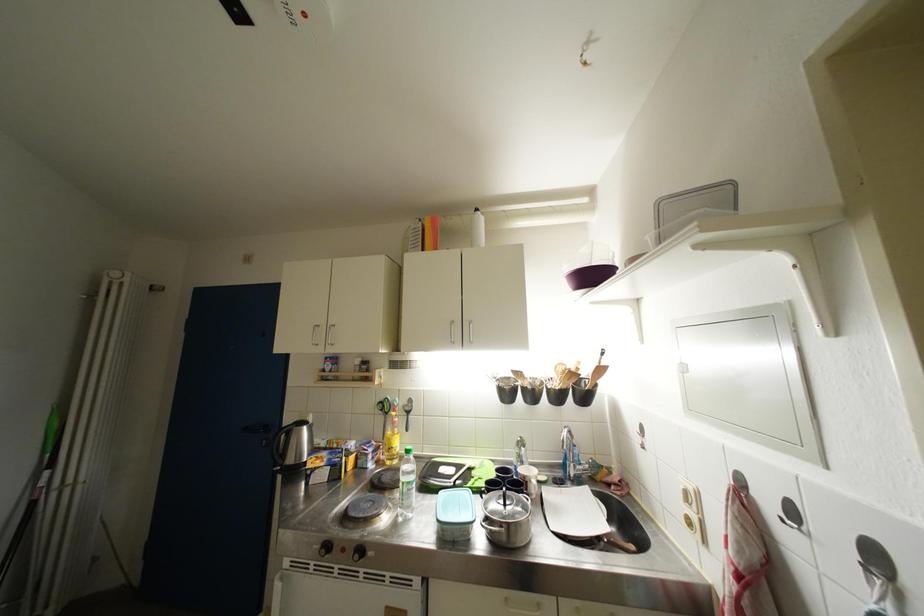
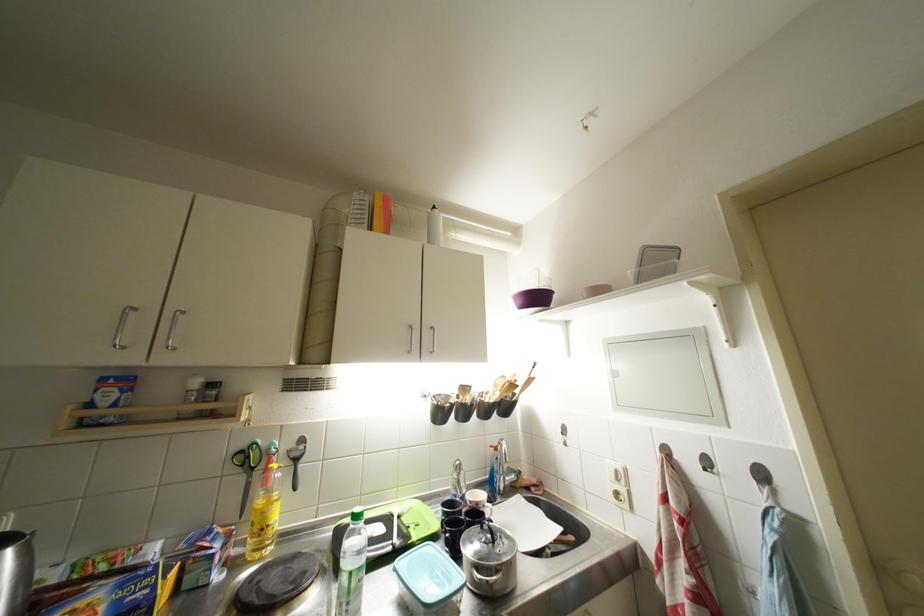
In the second image, find the point that corresponds to (x=531, y=480) in the first image.

(483, 508)